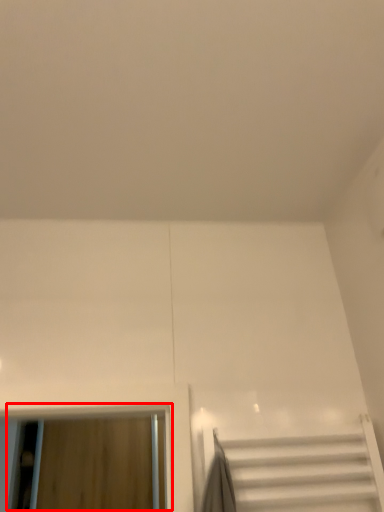
Question: From the image's perspective, considering the relative positions of window (annotated by the red box) and stairs in the image provided, where is window (annotated by the red box) located with respect to the staircase?

Choices:
 (A) above
 (B) below

Answer: (B)